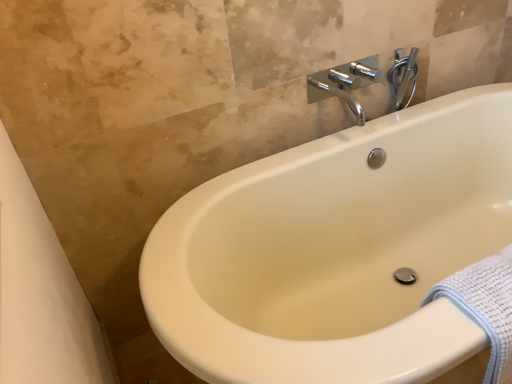
Question: From the image's perspective, would you say white textured towel at lower right is positioned over chrome metallic faucet at upper center?

Choices:
 (A) no
 (B) yes

Answer: (A)

Question: Is white textured towel at lower right outside chrome metallic faucet at upper center?

Choices:
 (A) no
 (B) yes

Answer: (B)

Question: From a real-world perspective, is white textured towel at lower right on chrome metallic faucet at upper center?

Choices:
 (A) yes
 (B) no

Answer: (B)

Question: Is white textured towel at lower right further to the viewer compared to chrome metallic faucet at upper center?

Choices:
 (A) no
 (B) yes

Answer: (A)

Question: Is white textured towel at lower right closer to camera compared to chrome metallic faucet at upper center?

Choices:
 (A) no
 (B) yes

Answer: (B)

Question: Considering the relative sizes of white textured towel at lower right and chrome metallic faucet at upper center in the image provided, is white textured towel at lower right smaller than chrome metallic faucet at upper center?

Choices:
 (A) yes
 (B) no

Answer: (A)

Question: Is white textured towel at lower right taller than chrome metallic faucet at upper right?

Choices:
 (A) yes
 (B) no

Answer: (A)

Question: Is white textured towel at lower right at the right side of chrome metallic faucet at upper right?

Choices:
 (A) yes
 (B) no

Answer: (A)

Question: From a real-world perspective, is white textured towel at lower right physically above chrome metallic faucet at upper right?

Choices:
 (A) no
 (B) yes

Answer: (A)

Question: Is white textured towel at lower right bigger than chrome metallic faucet at upper right?

Choices:
 (A) no
 (B) yes

Answer: (B)

Question: From the image's perspective, is white textured towel at lower right under chrome metallic faucet at upper right?

Choices:
 (A) yes
 (B) no

Answer: (A)

Question: Considering the relative sizes of white textured towel at lower right and chrome metallic faucet at upper right in the image provided, is white textured towel at lower right wider than chrome metallic faucet at upper right?

Choices:
 (A) no
 (B) yes

Answer: (B)

Question: From a real-world perspective, is chrome metallic faucet at upper center located higher than chrome metallic faucet at upper right?

Choices:
 (A) yes
 (B) no

Answer: (B)